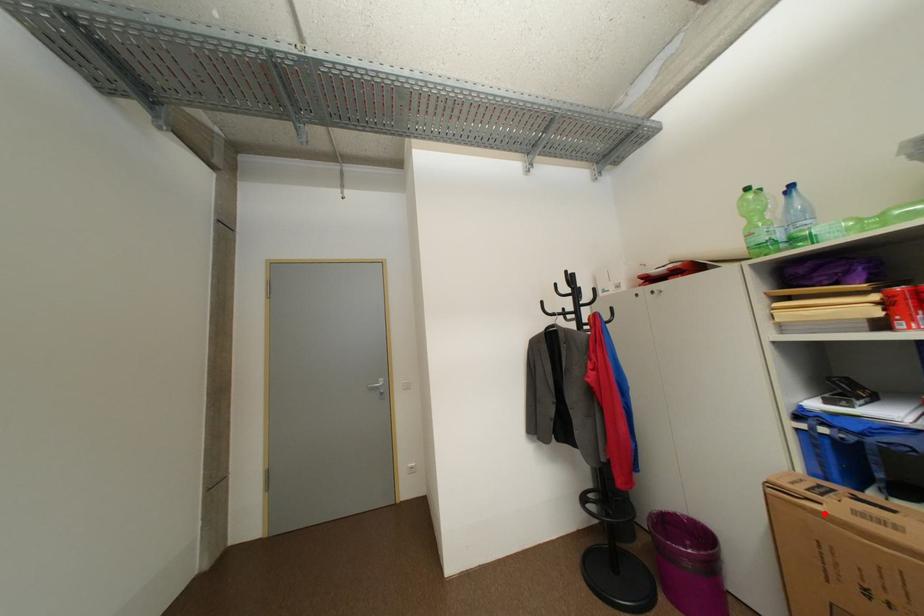
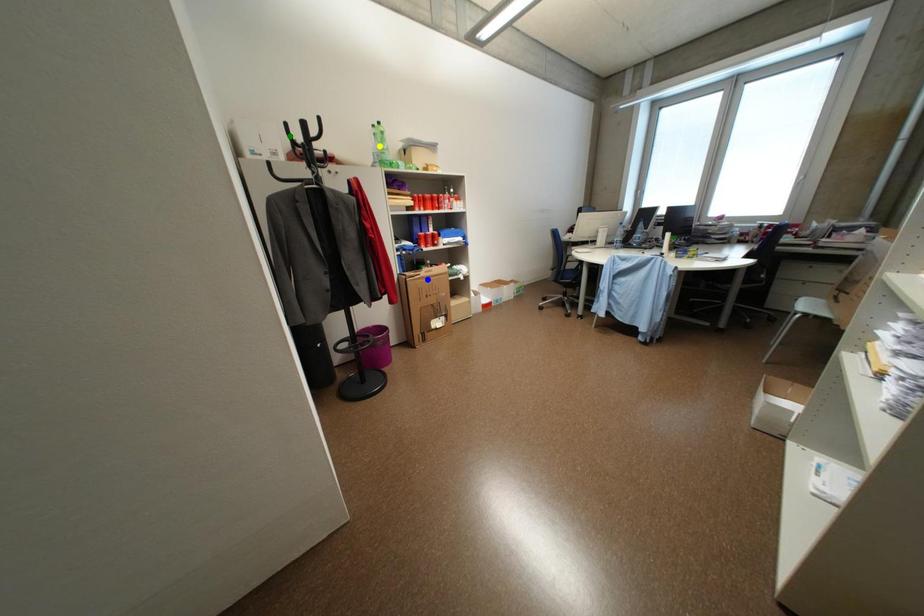
Question: I am providing you with two images of the same scene from different viewpoints. A red point is marked on the first image. You are given multiple points on the second image. Can you choose the point in image 2 that corresponds to the point in image 1?

Choices:
 (A) green point
 (B) blue point
 (C) yellow point

Answer: (B)